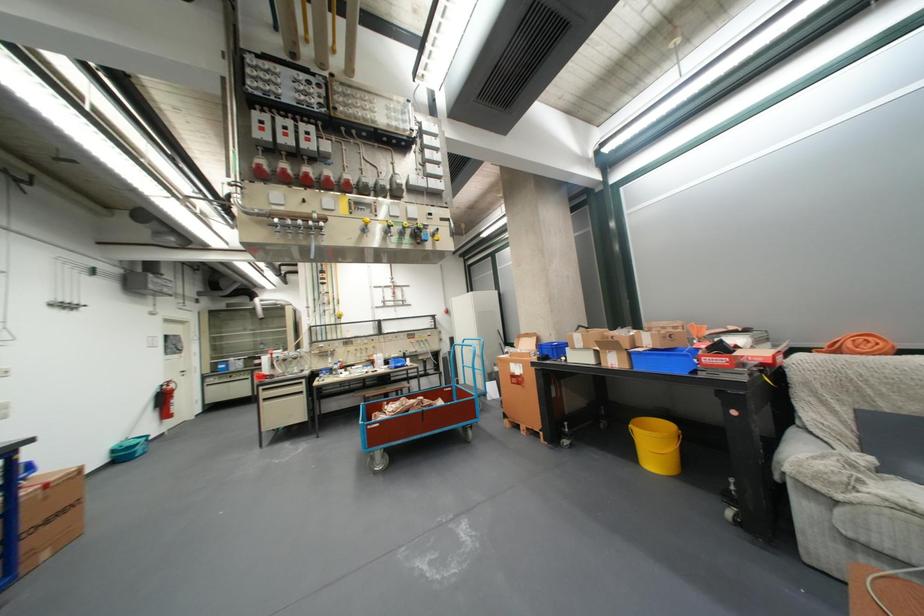
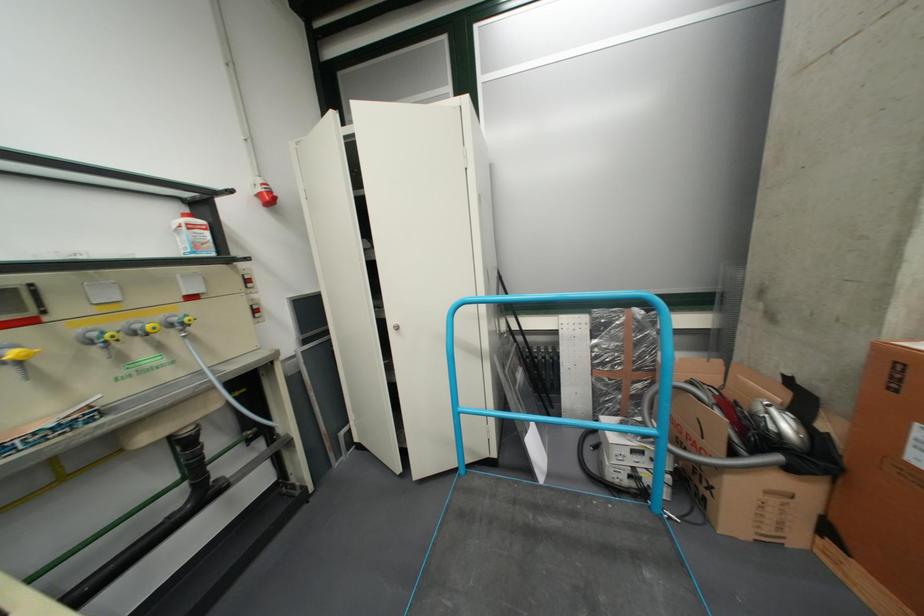
Find the pixel in the second image that matches (x=456, y=310) in the first image.

(260, 185)